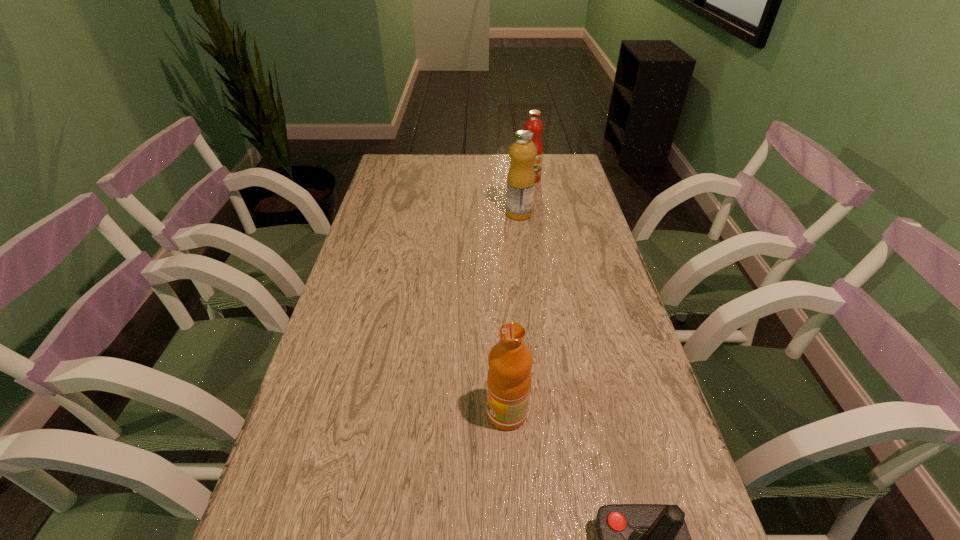
This screenshot has height=540, width=960. I want to click on vacant area in the image that satisfies the following two spatial constraints: 1. on the front label of the farthest fruit juice; 2. on the front label of the third nearest object, so click(536, 214).